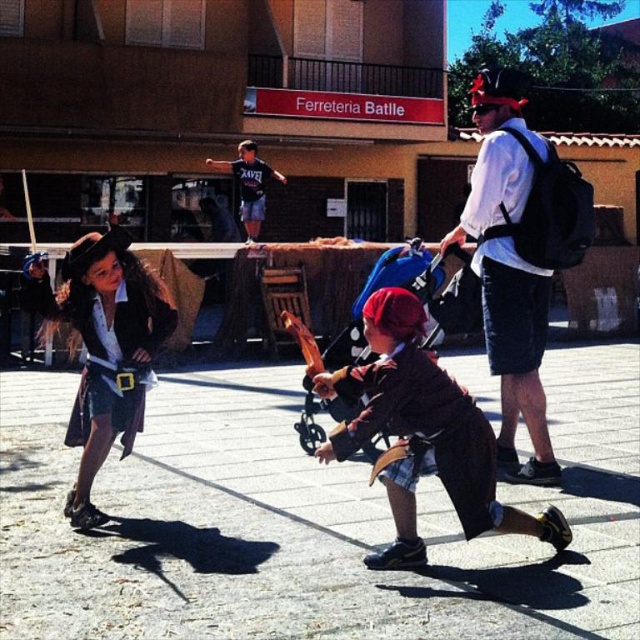
You are a photographer standing at the center of the scene. You want to take a photo of both the brown woolen coat at center and the shiny black pirate costume at left. Your camera has a maximum focus range of 1.8 meters. Will both subjects be in focus?

The distance between the brown woolen coat at center and the shiny black pirate costume at left is 1.76 meters, which is within the camera maximum focus range of 1.8 meters. Therefore, both subjects will be in focus.

You are standing at the camera position and want to throw a ball to the white cotton shirt at upper center. What is the approximate distance you need to throw the ball?

The distance between the white cotton shirt at upper center and the camera is 6.03 meters, so you need to throw the ball approximately 6.03 meters.